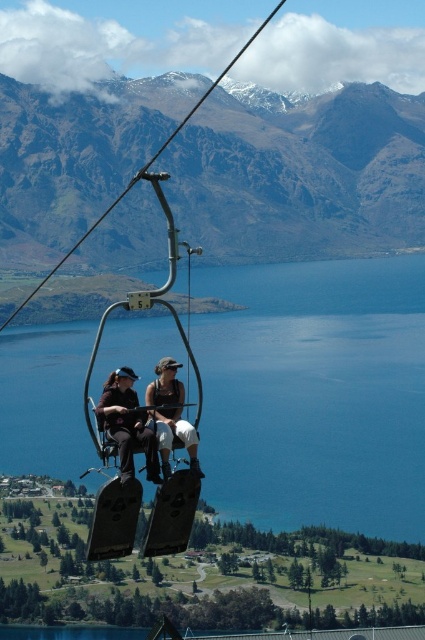
Question: Which point is farther to the camera?

Choices:
 (A) rugged brown mountain at upper center
 (B) matte black jacket at center
 (C) metallic gray ski lift seat at center
 (D) matte black seat at center

Answer: (A)

Question: Does rugged brown mountain at upper center have a larger size compared to matte black seat at center?

Choices:
 (A) no
 (B) yes

Answer: (B)

Question: In this image, where is rugged brown mountain at upper center located relative to matte black jacket at center?

Choices:
 (A) below
 (B) above

Answer: (B)

Question: Which point is farther to the camera?

Choices:
 (A) (104, 412)
 (B) (124, 486)

Answer: (A)

Question: Is rugged brown mountain at upper center below metallic gray ski lift at center?

Choices:
 (A) yes
 (B) no

Answer: (B)

Question: Considering the real-world distances, which object is closest to the metallic gray ski lift seat at center?

Choices:
 (A) matte black jacket at center
 (B) blue water at center
 (C) rugged brown mountain at upper center
 (D) matte black seat at center

Answer: (D)